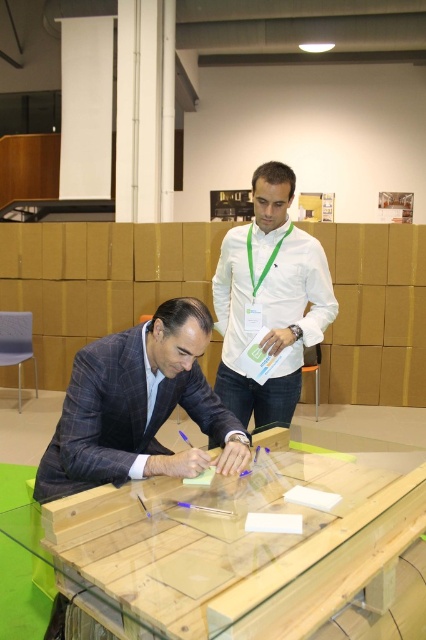
Can you confirm if plaid wool suit at lower left is taller than white smooth shirt at upper center?

No.

Does plaid wool suit at lower left have a larger size compared to white smooth shirt at upper center?

Incorrect, plaid wool suit at lower left is not larger than white smooth shirt at upper center.

Does point (75, 456) come in front of point (233, 256)?

Yes, it is.

Locate an element on the screen. This screenshot has height=640, width=426. plaid wool suit at lower left is located at coordinates coord(137,406).

Who is shorter, wooden table at center or plaid wool suit at lower left?

wooden table at center is shorter.

Does wooden table at center have a lesser width compared to plaid wool suit at lower left?

Incorrect, wooden table at center's width is not less than plaid wool suit at lower left's.

Between point (296, 573) and point (106, 352), which one is positioned in front?

Point (296, 573) is more forward.

Locate an element on the screen. The width and height of the screenshot is (426, 640). wooden table at center is located at coordinates (232, 552).

Does wooden table at center appear on the right side of white smooth shirt at upper center?

Yes, wooden table at center is to the right of white smooth shirt at upper center.

Can you confirm if wooden table at center is positioned below white smooth shirt at upper center?

Yes, wooden table at center is below white smooth shirt at upper center.

Who is more forward, (95, 499) or (290, 330)?

Point (95, 499) is more forward.

You are a GUI agent. You are given a task and a screenshot of the screen. Output one action in this format:
    pyautogui.click(x=<x>, y=<y>)
    Task: Click on the wooden table at center
    The width and height of the screenshot is (426, 640).
    Given the screenshot: What is the action you would take?
    pyautogui.click(x=232, y=552)